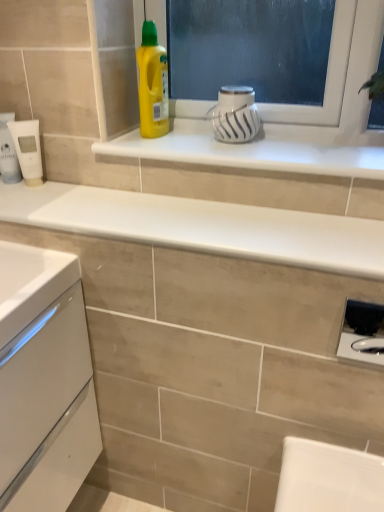
Question: In the image, is white glossy countertop at upper center positioned in front of or behind yellow plastic bottle at upper center?

Choices:
 (A) front
 (B) behind

Answer: (A)

Question: Would you say white glossy countertop at upper center is to the left or to the right of yellow plastic bottle at upper center in the picture?

Choices:
 (A) right
 (B) left

Answer: (A)

Question: Estimate the real-world distances between objects in this image. Which object is farther from the white glossy mug at upper center, the second appliance from the back?

Choices:
 (A) white glossy shelf at upper center
 (B) white glossy countertop at upper center
 (C) satin black soap dispenser at lower right, placed as the 3th appliance when sorted from back to front
 (D) white matte tube at left
 (E) white matte tube at left, which is the 3th appliance from front to back

Answer: (C)

Question: Based on their relative distances, which object is farther from the white glossy mug at upper center, the 1th appliance from the top?

Choices:
 (A) satin black soap dispenser at lower right, which appears as the 1th appliance when viewed from the right
 (B) white glossy countertop at upper center
 (C) white glossy shelf at upper center
 (D) white matte tube at left
 (E) white matte tube at left, acting as the second appliance starting from the bottom

Answer: (A)